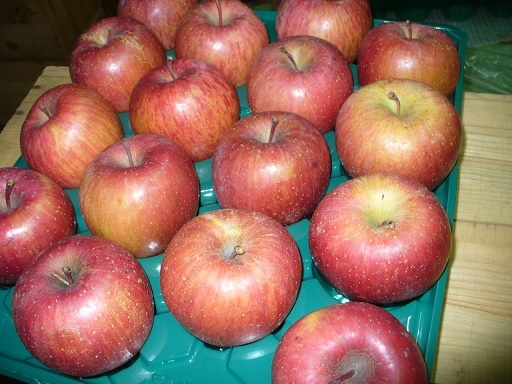
At what (x,y) coordinates should I click in order to perform the action: click on blue tray. Please return your answer as a coordinate pair (x, y). This screenshot has width=512, height=384. Looking at the image, I should click on (179, 355), (451, 190), (421, 323), (316, 296).